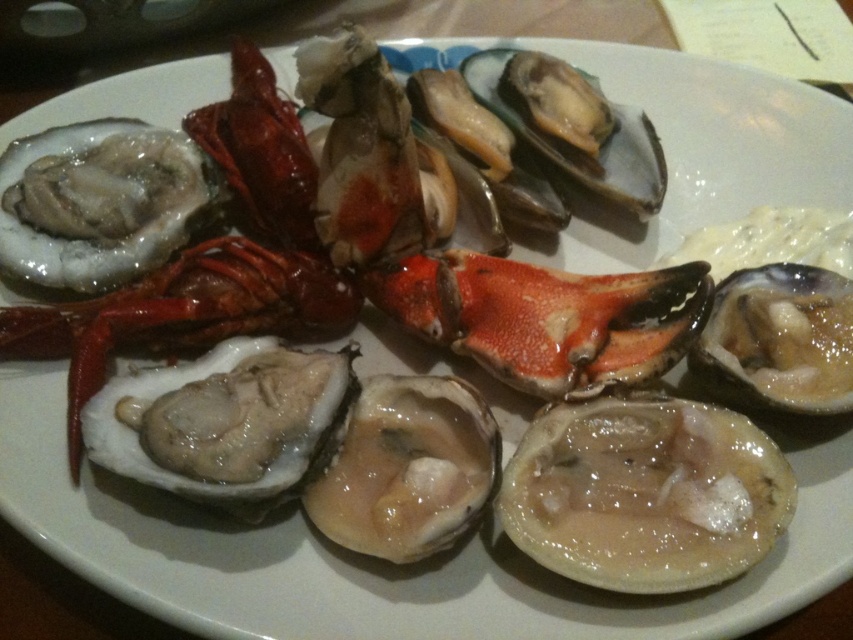
Who is shorter, shiny red lobster at center or translucent shell oyster at center?

translucent shell oyster at center is shorter.

Who is lower down, shiny red lobster at center or translucent shell oyster at center?

shiny red lobster at center

Which is in front, point (306, 324) or point (744, 308)?

Point (744, 308) is in front.

Where is `shiny red lobster at center`? The width and height of the screenshot is (853, 640). shiny red lobster at center is located at coordinates (x=181, y=314).

Who is lower down, translucent gelatinous shellfish at center or shiny orange lobster claw at center?

translucent gelatinous shellfish at center

Who is positioned more to the left, translucent gelatinous shellfish at center or shiny orange lobster claw at center?

shiny orange lobster claw at center is more to the left.

Does point (550, 481) come in front of point (512, 269)?

Yes, point (550, 481) is in front of point (512, 269).

At what (x,y) coordinates should I click in order to perform the action: click on translucent gelatinous shellfish at center. Please return your answer as a coordinate pair (x, y). The image size is (853, 640). Looking at the image, I should click on (645, 493).

Is translucent gelatinous shellfish at center thinner than translucent shell oyster at center?

No.

Does point (595, 460) lie behind point (833, 291)?

No, (595, 460) is in front of (833, 291).

Locate an element on the screen. The width and height of the screenshot is (853, 640). translucent gelatinous shellfish at center is located at coordinates (645, 493).